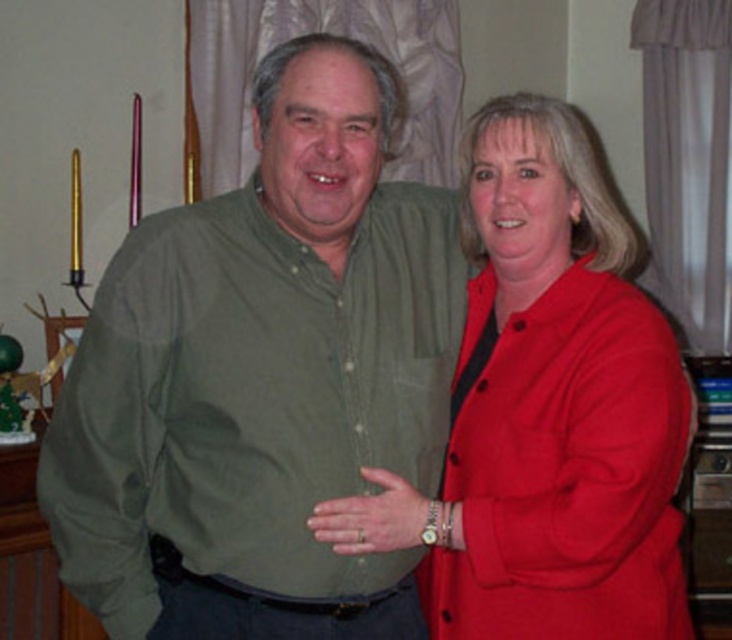
Question: Among these points, which one is nearest to the camera?

Choices:
 (A) (244, 372)
 (B) (635, 307)

Answer: (A)

Question: Can you confirm if green cotton shirt at center is positioned below matte red blazer at center?

Choices:
 (A) yes
 (B) no

Answer: (A)

Question: Which point appears closest to the camera in this image?

Choices:
 (A) (132, 516)
 (B) (675, 483)

Answer: (B)

Question: Can you confirm if green cotton shirt at center is wider than matte red blazer at center?

Choices:
 (A) no
 (B) yes

Answer: (B)

Question: Can you confirm if green cotton shirt at center is smaller than matte red blazer at center?

Choices:
 (A) yes
 (B) no

Answer: (A)